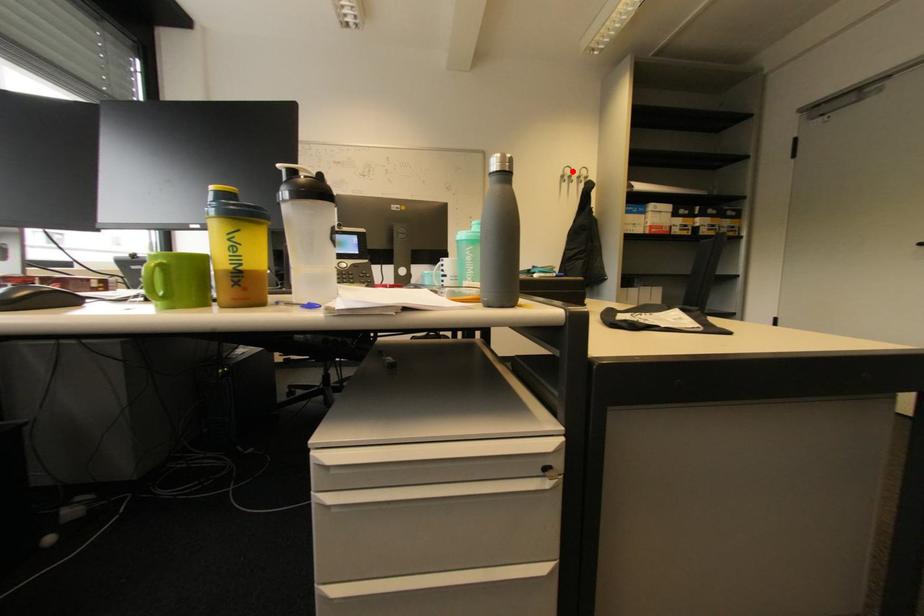
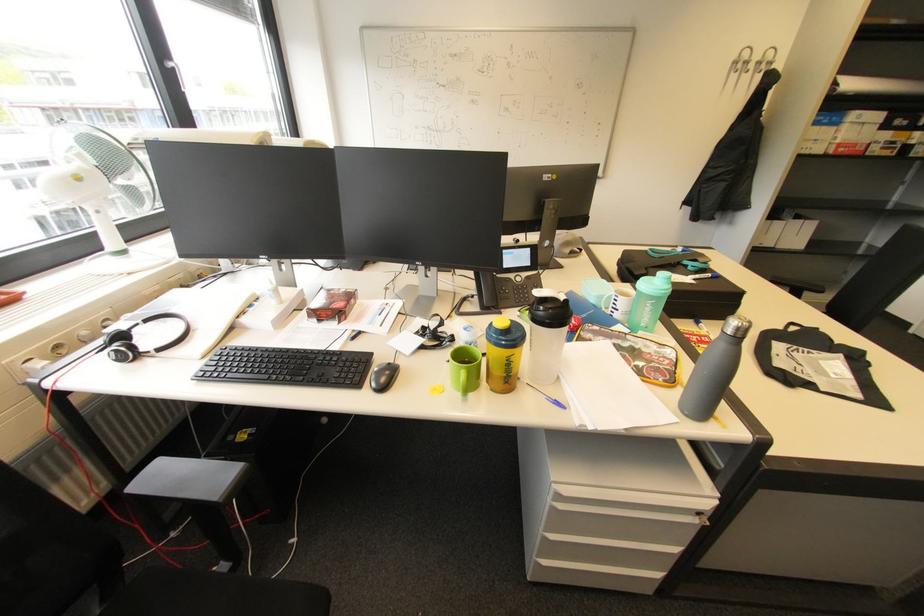
In the second image, find the point that corresponds to the highlighted location in the first image.

(751, 54)